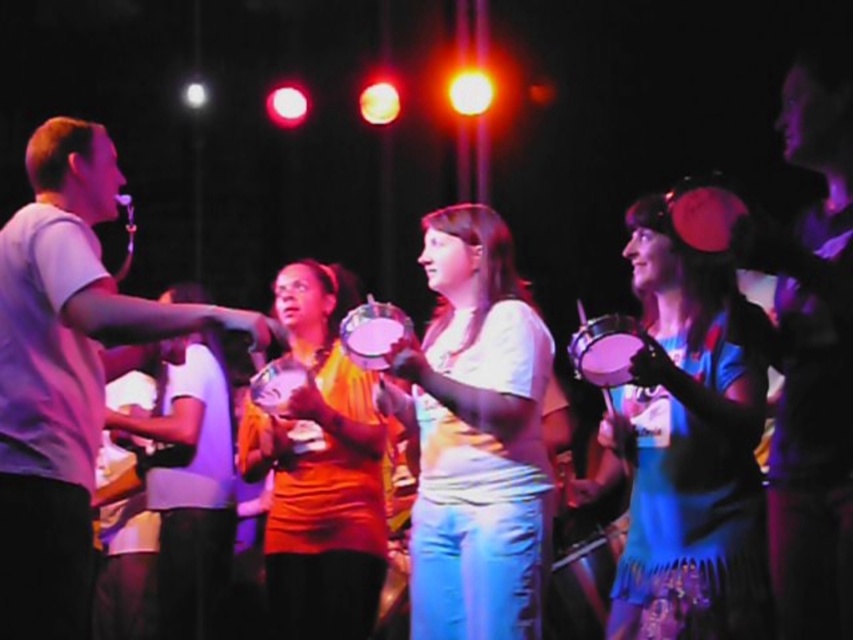
You are a photographer positioned at the back of the stage. You want to take a photo that includes both the blue fabric tambourine at right and the matte white shirt at left. Which object will appear closer to you in the photo?

The blue fabric tambourine at right will appear closer to you in the photo because it is further to the viewer than the matte white shirt at left.

You are a photographer trying to capture a closeup of the white matte shirt at center and the orange matte drum at center. Since you want to focus on both, which object should you zoom in on more to ensure both are in frame?

The white matte shirt at center occupies less space than the orange matte drum at center, so you should zoom in more on the orange matte drum at center to ensure both fit into the frame.

You are a photographer positioned to the left of the scene. You want to take a photo that includes both the white matte shirt at center and the orange matte drum at center. Which object should you adjust your camera to focus on first to ensure both are in frame?

Since the white matte shirt at center is to the right of the orange matte drum at center, you should first focus on the orange matte drum at center to ensure both objects are included in the frame from left to right.